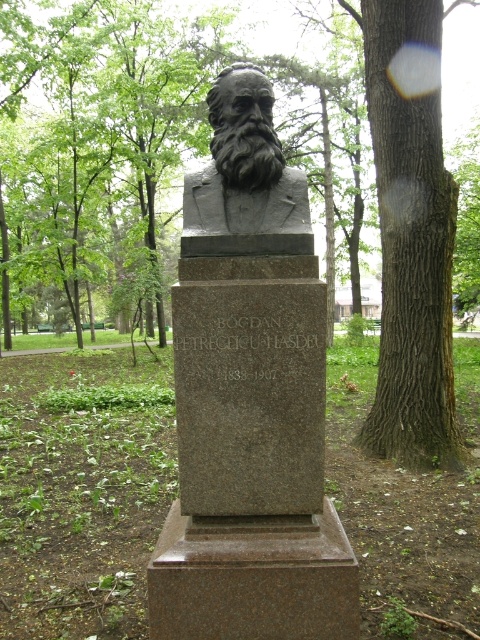
Is point (200, 465) farther from camera compared to point (265, 92)?

No.

This screenshot has height=640, width=480. I want to click on granite bust at center, so click(250, 401).

Describe the element at coordinates (250, 401) in the screenshot. I see `granite bust at center` at that location.

Can you confirm if granite bust at center is shorter than brown textured tree trunk at center-right?

Yes, granite bust at center is shorter than brown textured tree trunk at center-right.

Is point (276, 140) positioned after point (313, 160)?

No, (276, 140) is in front of (313, 160).

Identify the location of granite bust at center. This screenshot has height=640, width=480. (250, 401).

Which is behind, point (117, 291) or point (263, 188)?

The point (117, 291) is more distant.

Can you confirm if brown textured tree trunk at center-right is positioned to the right of black stone bust at center?

Correct, you'll find brown textured tree trunk at center-right to the right of black stone bust at center.

Image resolution: width=480 pixels, height=640 pixels. In order to click on brown textured tree trunk at center-right in this screenshot , I will do click(120, 145).

This screenshot has width=480, height=640. Identify the location of brown textured tree trunk at center-right. coord(120,145).